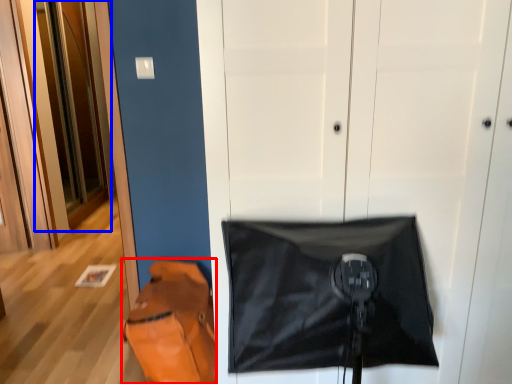
Question: Among these objects, which one is nearest to the camera, messenger bag (highlighted by a red box) or door (highlighted by a blue box)?

Choices:
 (A) messenger bag
 (B) door

Answer: (A)